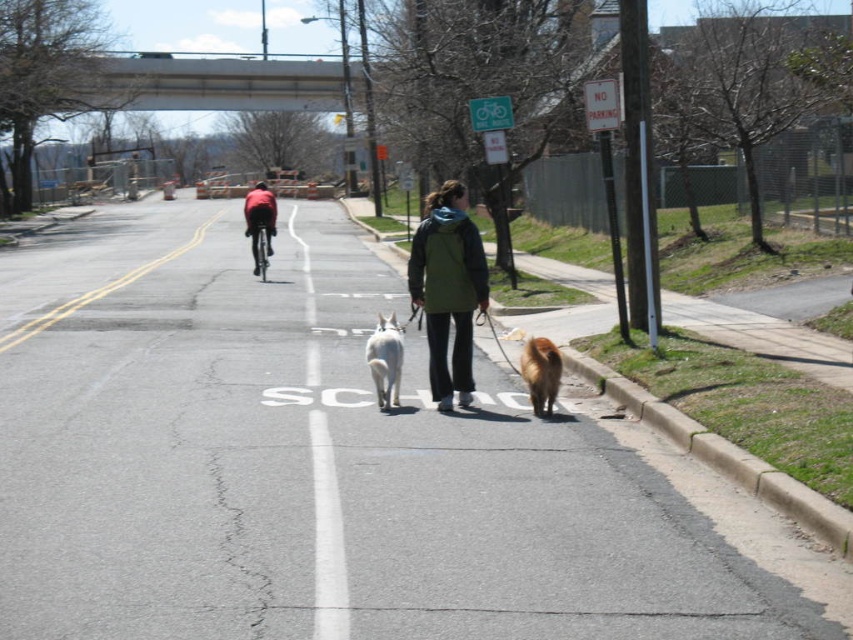
Question: Can you confirm if white fur dog at center is positioned to the right of red fabric jacket at center?

Choices:
 (A) no
 (B) yes

Answer: (B)

Question: Is red fabric jacket at center wider than shiny metallic bicycle at center?

Choices:
 (A) no
 (B) yes

Answer: (B)

Question: Which of the following is the farthest from the observer?

Choices:
 (A) green matte jacket at center
 (B) shiny metallic bicycle at center
 (C) red fabric jacket at center
 (D) brown furry dog at center

Answer: (C)

Question: Which object is farther from the camera taking this photo?

Choices:
 (A) red fabric jacket at center
 (B) brown furry dog at center
 (C) green matte jacket at center

Answer: (A)

Question: Among these objects, which one is farthest from the camera?

Choices:
 (A) white fur dog at center
 (B) shiny metallic bicycle at center
 (C) brown furry dog at center
 (D) red fabric jacket at center

Answer: (D)

Question: Considering the relative positions of white fur dog at center and brown furry dog at center in the image provided, where is white fur dog at center located with respect to brown furry dog at center?

Choices:
 (A) left
 (B) right

Answer: (A)